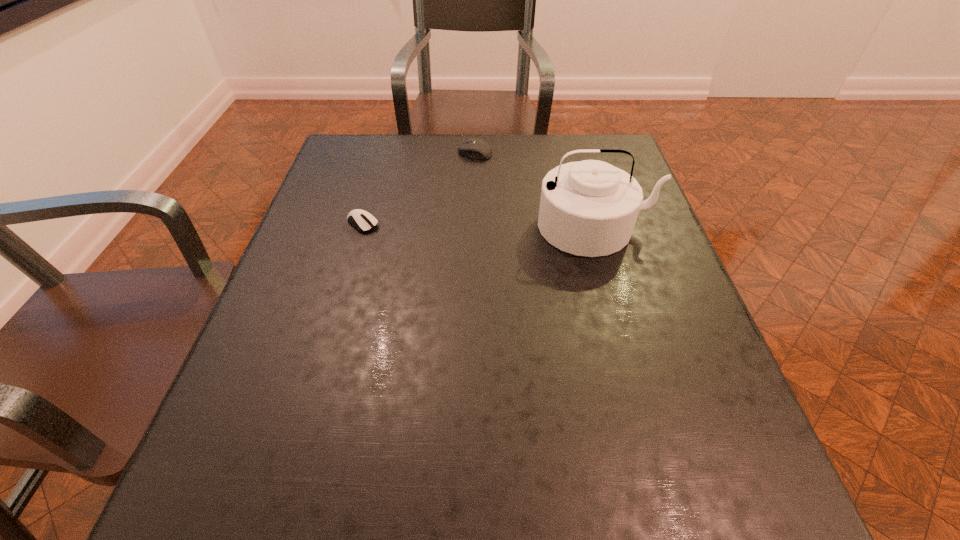
The width and height of the screenshot is (960, 540). Find the location of `object that is at the left edge`. object that is at the left edge is located at coordinates (362, 220).

At what (x,y) coordinates should I click in order to perform the action: click on object present at the right edge. Please return your answer as a coordinate pair (x, y). The image size is (960, 540). Looking at the image, I should click on (589, 208).

Where is `free space at the far edge of the desktop`? The width and height of the screenshot is (960, 540). free space at the far edge of the desktop is located at coordinates (452, 146).

At what (x,y) coordinates should I click in order to perform the action: click on vacant position at the near edge of the desktop. Please return your answer as a coordinate pair (x, y). Looking at the image, I should click on (539, 477).

What are the coordinates of `vacant space at the left edge of the desktop` in the screenshot? It's located at (236, 430).

You are a GUI agent. You are given a task and a screenshot of the screen. Output one action in this format:
    pyautogui.click(x=<x>, y=<y>)
    Task: Click on the vacant space at the right edge of the desktop
    
    Given the screenshot: What is the action you would take?
    pyautogui.click(x=674, y=374)

Where is `free spot at the far left corner of the desktop`? This screenshot has width=960, height=540. free spot at the far left corner of the desktop is located at coordinates (341, 136).

Where is `vacant region at the near left corner of the desktop`? This screenshot has width=960, height=540. vacant region at the near left corner of the desktop is located at coordinates (274, 524).

Image resolution: width=960 pixels, height=540 pixels. Identify the location of vacant area at the far right corner of the desktop. (583, 140).

At what (x,y) coordinates should I click in order to perform the action: click on vacant space at the near right corner of the desktop. Please return your answer as a coordinate pair (x, y). Looking at the image, I should click on (789, 531).